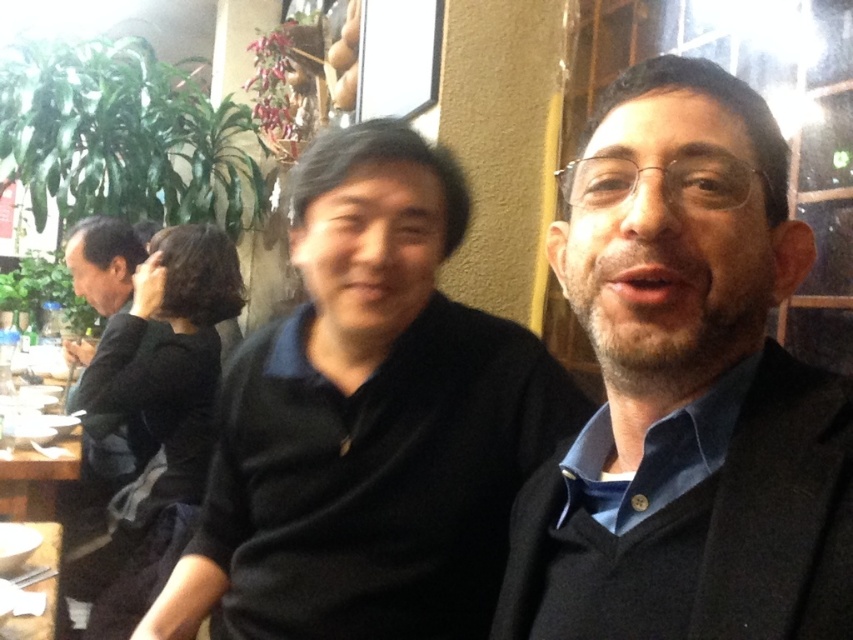
Question: Which point is farther from the camera taking this photo?

Choices:
 (A) 445,387
 (B) 759,244
 (C) 67,451

Answer: (C)

Question: Which point is farther to the camera?

Choices:
 (A) dark blue sweater at center
 (B) wooden table at lower left

Answer: (B)

Question: Is black matte shirt at center closer to camera compared to black matte shirt at left?

Choices:
 (A) no
 (B) yes

Answer: (B)

Question: Can you confirm if black matte shirt at center is thinner than white glossy table at lower left?

Choices:
 (A) yes
 (B) no

Answer: (B)

Question: Which is nearer to the wooden table at lower left?

Choices:
 (A) black matte shirt at left
 (B) black matte shirt at center
 (C) white glossy table at lower left

Answer: (B)

Question: In this image, where is white glossy table at lower left located relative to wooden table at lower left?

Choices:
 (A) above
 (B) below

Answer: (A)